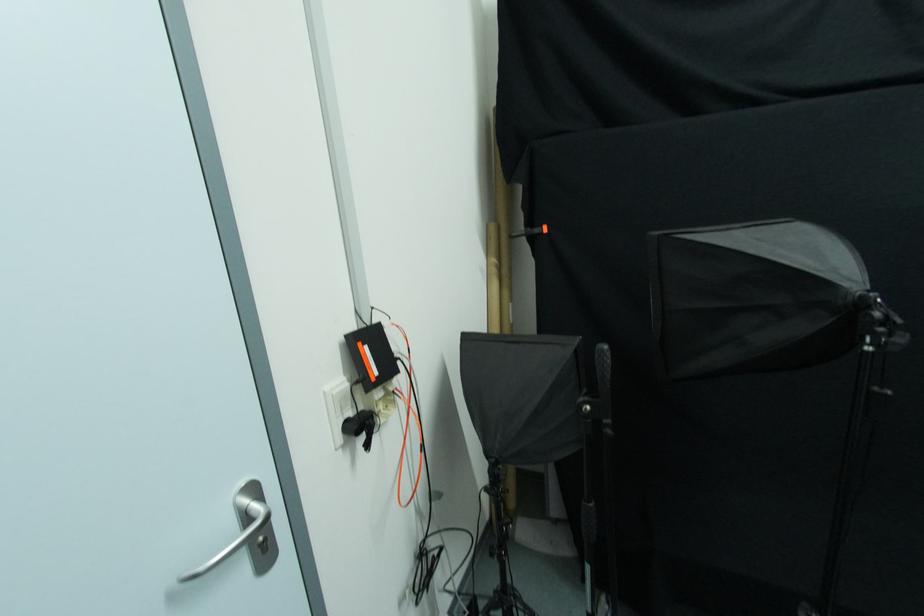
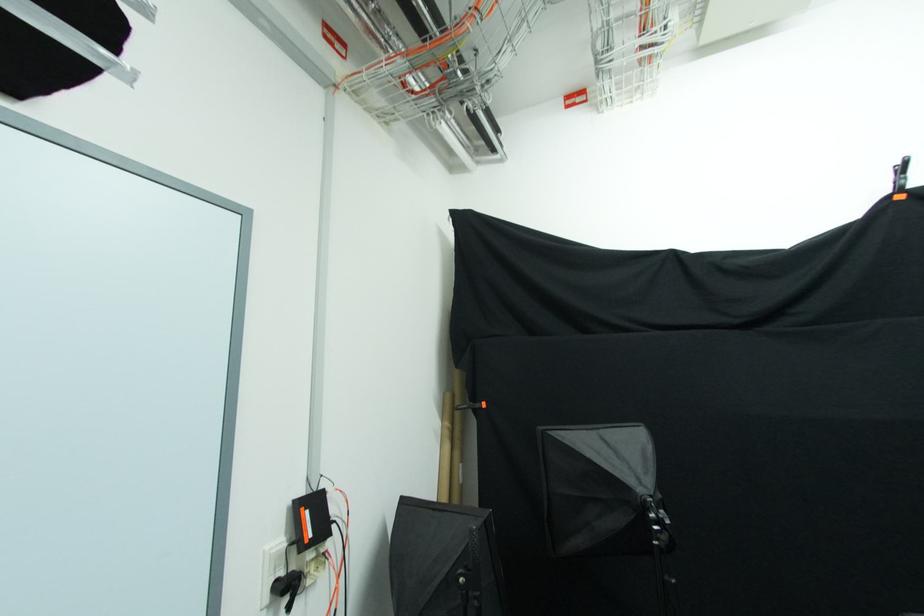
Find the pixel in the second image that matches the point at 495,264 in the first image.

(448, 427)